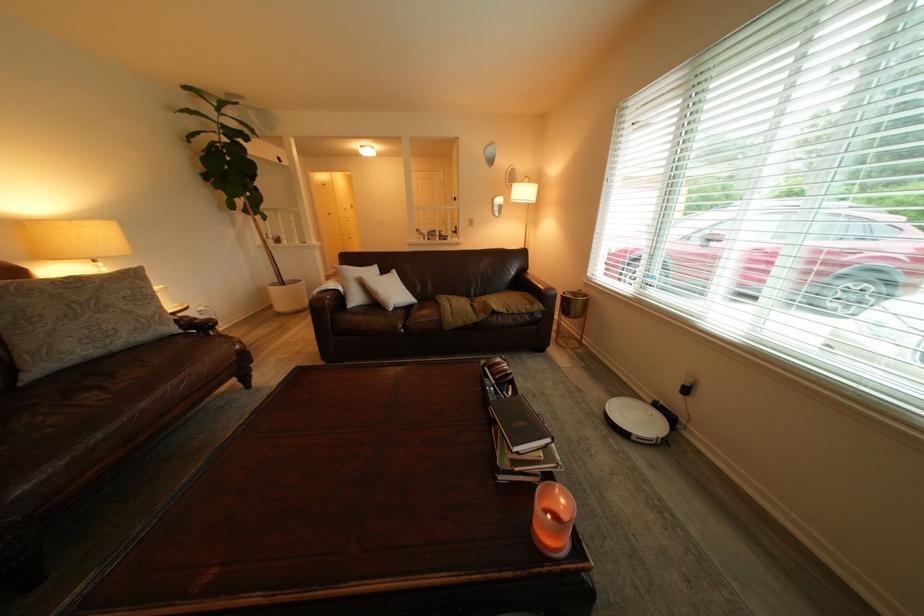
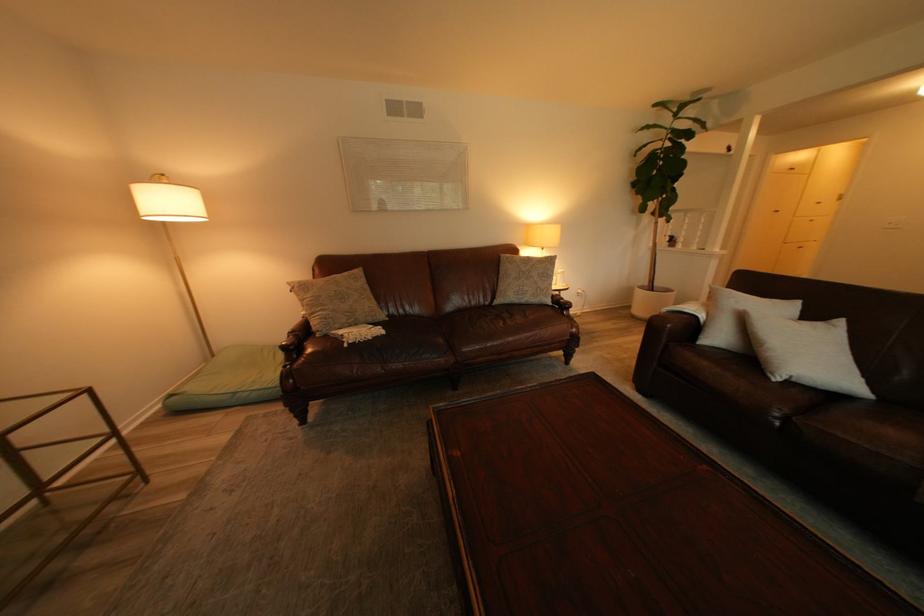
The point at (403, 312) is marked in the first image. Where is the corresponding point in the second image?

(784, 379)